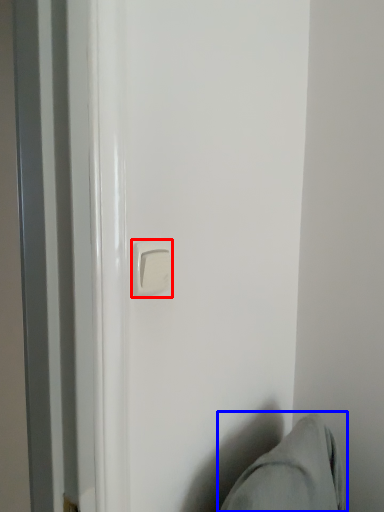
Question: Which of the following is the farthest to the observer, door handle (highlighted by a red box) or swivel chair (highlighted by a blue box)?

Choices:
 (A) door handle
 (B) swivel chair

Answer: (A)